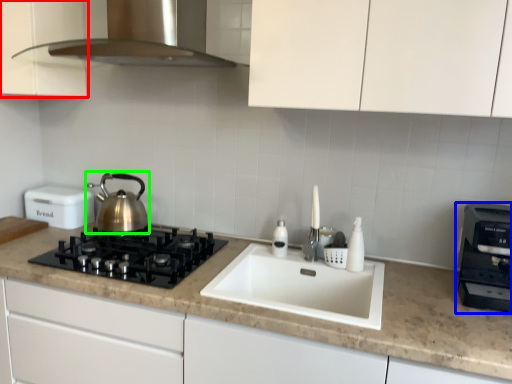
Question: Which object is the closest to the cabinetry (highlighted by a red box)? Choose among these: kitchen appliance (highlighted by a blue box) or kettle (highlighted by a green box).

Choices:
 (A) kitchen appliance
 (B) kettle

Answer: (B)